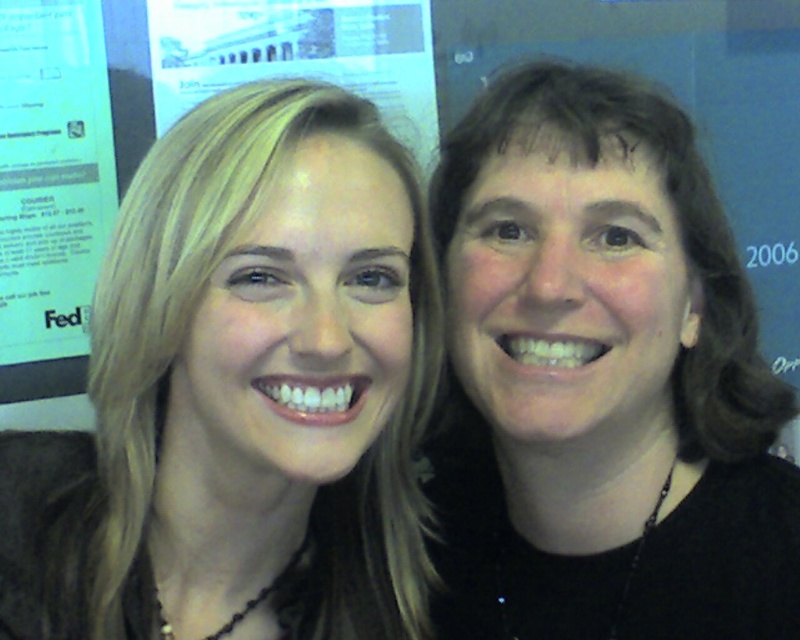
Describe the element at coordinates (242, 394) in the screenshot. This screenshot has height=640, width=800. I see `blonde hair at left` at that location.

Can you confirm if blonde hair at left is positioned above white paper at left?

Actually, blonde hair at left is below white paper at left.

The image size is (800, 640). I want to click on blonde hair at left, so click(242, 394).

Is white paper at left below white paper at upper center?

Yes, white paper at left is below white paper at upper center.

Between white paper at left and white paper at upper center, which one is positioned higher?

white paper at upper center is above.

Identify the location of white paper at left. The image size is (800, 640). (52, 173).

Identify the location of blonde hair at left. (242, 394).

Does blonde hair at left lie in front of white paper at upper center?

Yes, blonde hair at left is in front of white paper at upper center.

Identify the location of blonde hair at left. This screenshot has height=640, width=800. coord(242,394).